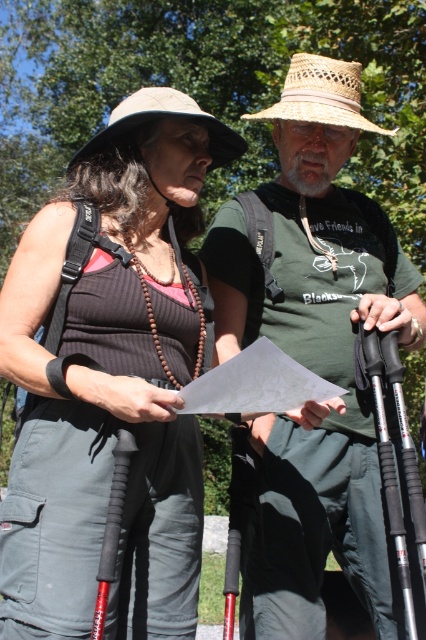
Question: Which point appears farthest from the camera in this image?

Choices:
 (A) pyautogui.click(x=157, y=116)
 (B) pyautogui.click(x=367, y=529)
 (C) pyautogui.click(x=117, y=180)

Answer: (B)

Question: In this image, where is matte black vest at center located relative to green cotton shirt at center?

Choices:
 (A) right
 (B) left

Answer: (B)

Question: Estimate the real-world distances between objects in this image. Which object is closer to the matte black vest at center?

Choices:
 (A) natural straw hat at upper center
 (B) green cotton shirt at center

Answer: (B)

Question: In this image, where is matte black vest at center located relative to natural straw hat at upper center?

Choices:
 (A) above
 (B) below

Answer: (B)

Question: Estimate the real-world distances between objects in this image. Which object is closer to the natural straw hat at upper center?

Choices:
 (A) matte black vest at center
 (B) green cotton shirt at center

Answer: (B)

Question: Is matte black vest at center positioned in front of green cotton shirt at center?

Choices:
 (A) no
 (B) yes

Answer: (B)